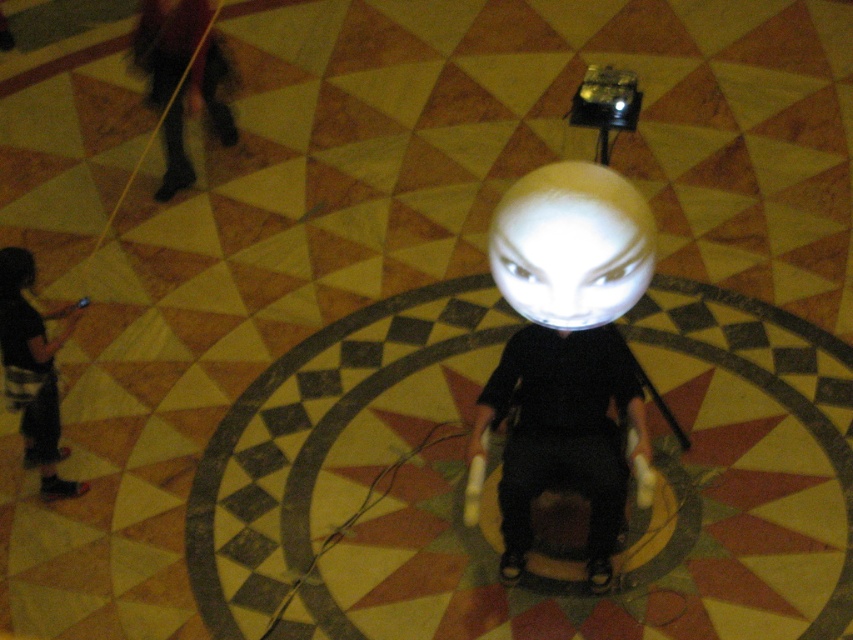
Is point (579, 216) less distant than point (16, 248)?

Yes, it is.

Is point (537, 317) farther from viewer compared to point (3, 284)?

No.

Who is more distant from viewer, (x=625, y=310) or (x=4, y=292)?

Positioned behind is point (x=4, y=292).

At what (x,y) coordinates should I click in order to perform the action: click on white glossy sphere at center. Please return your answer as a coordinate pair (x, y). This screenshot has width=853, height=640. Looking at the image, I should click on (572, 244).